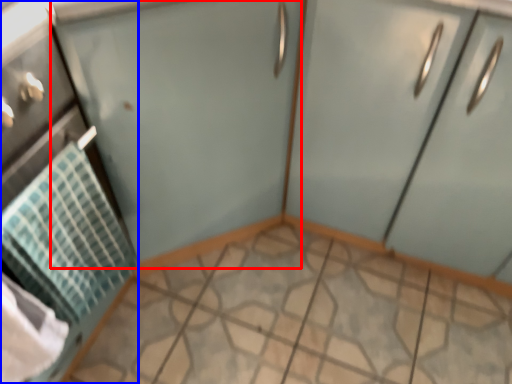
Question: Which object is further to the camera taking this photo, screen door (highlighted by a red box) or appliance (highlighted by a blue box)?

Choices:
 (A) screen door
 (B) appliance

Answer: (A)